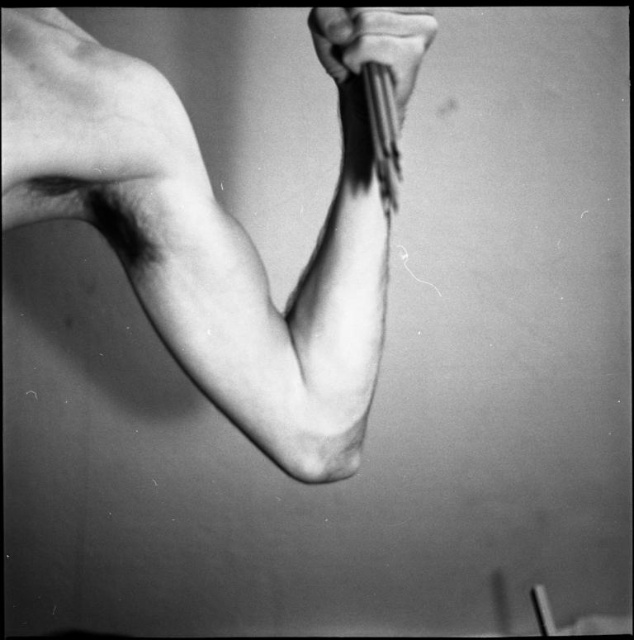
Question: Which object is closer to the camera taking this photo?

Choices:
 (A) smooth black pen at upper center
 (B) smooth skin arm at center

Answer: (B)

Question: Can you confirm if smooth skin arm at center is positioned below smooth black pen at upper center?

Choices:
 (A) yes
 (B) no

Answer: (A)

Question: Is smooth skin arm at center further to camera compared to smooth black pen at upper center?

Choices:
 (A) no
 (B) yes

Answer: (A)

Question: Which point is farther to the camera?

Choices:
 (A) (403, 104)
 (B) (184, 204)

Answer: (B)

Question: Where is smooth skin arm at center located in relation to smooth black pen at upper center in the image?

Choices:
 (A) left
 (B) right

Answer: (A)